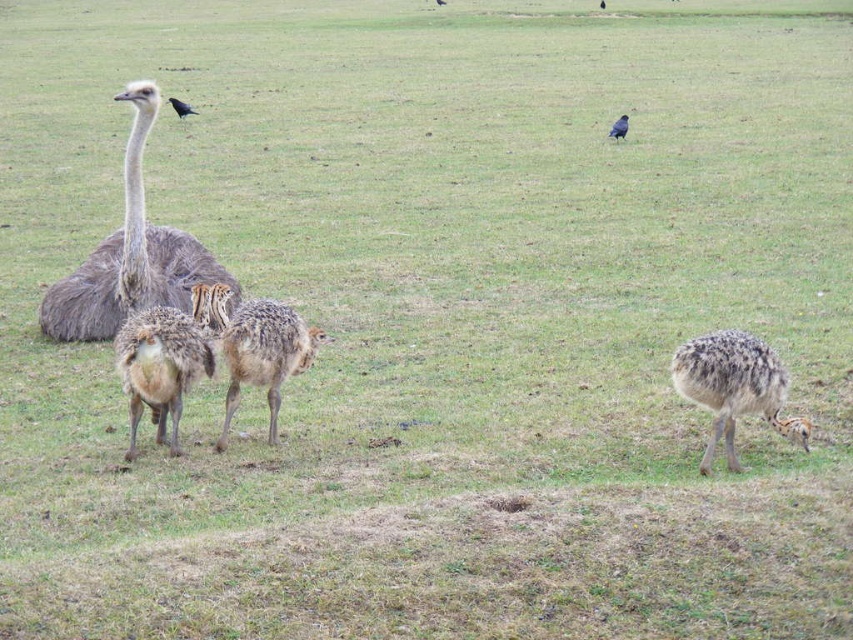
Question: Which object is the farthest from the black feathered bird at upper left?

Choices:
 (A) speckled feathered ostrich at center
 (B) gray feathered ostrich at left
 (C) shiny black bird at upper right
 (D) brown speckled feathers at center

Answer: (D)

Question: Estimate the real-world distances between objects in this image. Which object is farther from the brown speckled feathers at center?

Choices:
 (A) speckled feathered ostrich at center
 (B) black feathered bird at upper left

Answer: (B)

Question: Which object appears closest to the camera in this image?

Choices:
 (A) speckled feathered ostrich at center
 (B) gray feathered ostrich at left

Answer: (A)

Question: Does speckled feathered ostrich at center come in front of shiny black bird at upper right?

Choices:
 (A) no
 (B) yes

Answer: (B)

Question: Considering the relative positions of shiny black bird at upper right and black feathered bird at upper left in the image provided, where is shiny black bird at upper right located with respect to black feathered bird at upper left?

Choices:
 (A) below
 (B) above

Answer: (A)

Question: Is gray feathered ostrich at left further to the viewer compared to shiny black bird at upper right?

Choices:
 (A) yes
 (B) no

Answer: (B)